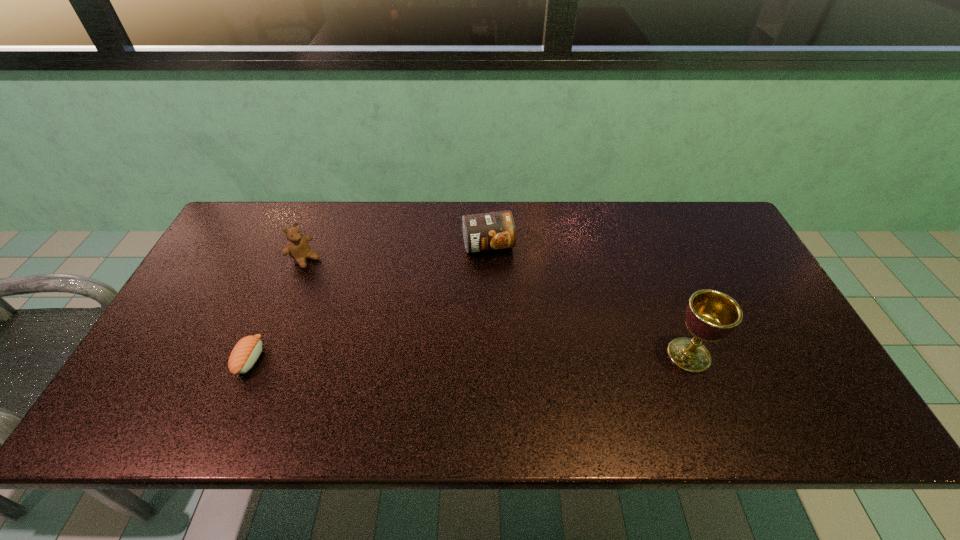
Locate an element on the screen. The height and width of the screenshot is (540, 960). blank area at the right edge is located at coordinates (746, 329).

Find the location of a particular element. free space at the far left corner of the desktop is located at coordinates (280, 223).

Identify the location of vacant region at the far right corner of the desktop. This screenshot has height=540, width=960. (673, 208).

Image resolution: width=960 pixels, height=540 pixels. I want to click on empty space that is in between the chalice and the teddy bear, so click(497, 307).

At what (x,y) coordinates should I click in order to perform the action: click on empty location between the teddy bear and the shortest object. Please return your answer as a coordinate pair (x, y). The width and height of the screenshot is (960, 540). Looking at the image, I should click on (277, 309).

I want to click on vacant space that is in between the third object from left to right and the sushi, so click(x=370, y=302).

Find the location of a particular element. free spot between the rightmost object and the sushi is located at coordinates (469, 357).

Find the location of `free point between the shortest object and the teddy bear`. free point between the shortest object and the teddy bear is located at coordinates (277, 309).

Locate an element on the screen. This screenshot has height=540, width=960. vacant region between the third object from left to right and the chalice is located at coordinates (588, 300).

Identify the location of free space between the can and the tallest object. (588, 300).